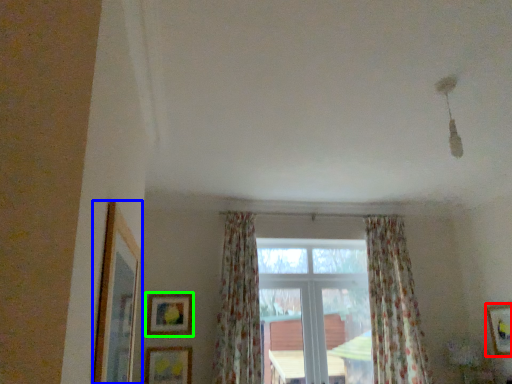
Question: Estimate the real-world distances between objects in this image. Which object is closer to picture frame (highlighted by a red box), picture frame (highlighted by a blue box) or picture frame (highlighted by a green box)?

Choices:
 (A) picture frame
 (B) picture frame

Answer: (B)